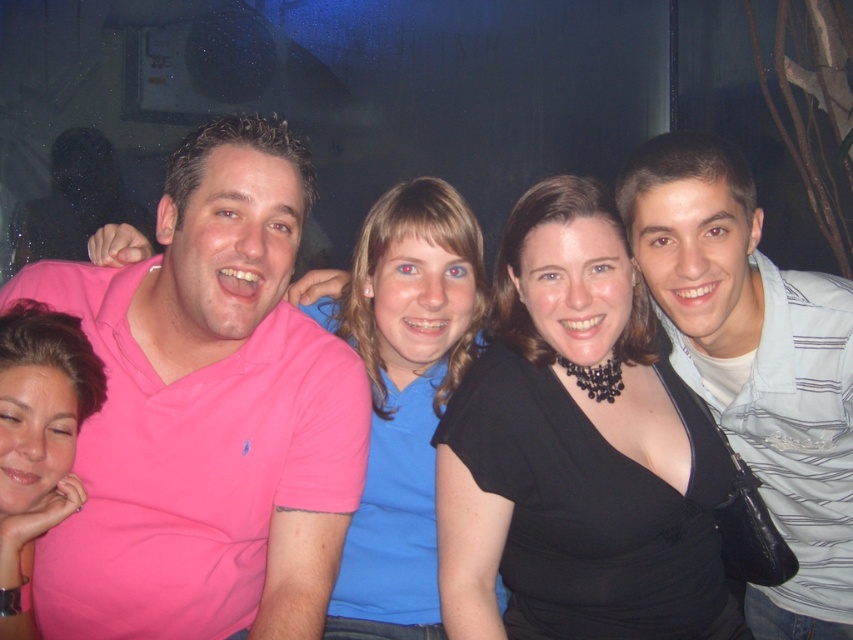
Question: Among these points, which one is farthest from the camera?

Choices:
 (A) (38, 483)
 (B) (415, 474)
 (C) (747, 243)
 (D) (463, 568)

Answer: (B)

Question: Which is farther from the light blue striped shirt at right?

Choices:
 (A) black matte necklace at center
 (B) blue matte shirt at center
 (C) matte pink shirt at lower left

Answer: (C)

Question: Is light blue striped shirt at right smaller than blue matte shirt at center?

Choices:
 (A) yes
 (B) no

Answer: (B)

Question: Which object is farther from the camera taking this photo?

Choices:
 (A) pink cotton shirt at left
 (B) blue matte shirt at center

Answer: (B)

Question: Is pink cotton shirt at left closer to camera compared to black matte necklace at center?

Choices:
 (A) no
 (B) yes

Answer: (B)

Question: Observing the image, what is the correct spatial positioning of pink cotton shirt at left in reference to light blue striped shirt at right?

Choices:
 (A) left
 (B) right

Answer: (A)